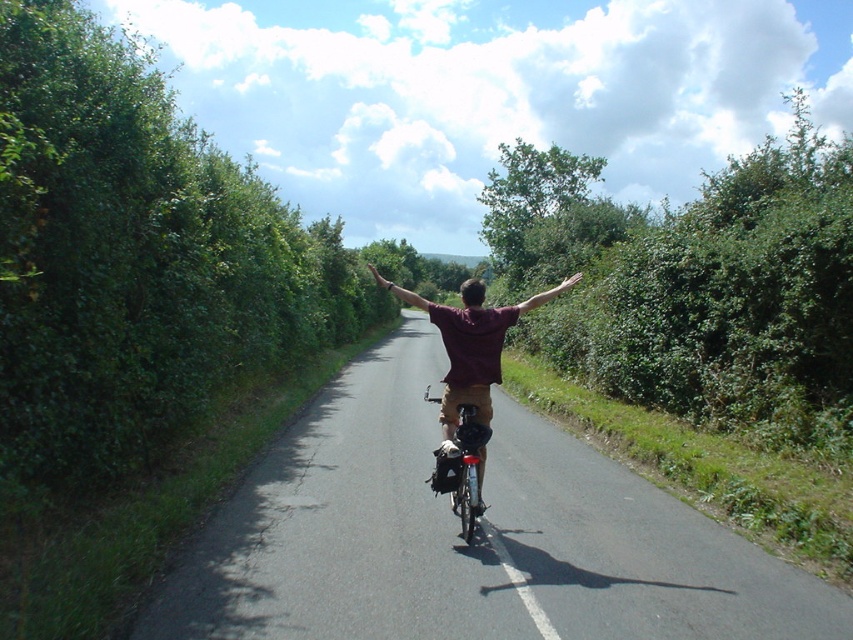
You are a cyclist on the narrow road and you want to check if your hand is above your arm while riding. Based on the scene, is the smooth skin hand at upper center positioned above the brown fabric arm at center?

Yes, the smooth skin hand at upper center is positioned above the brown fabric arm at center as described in the scene.

You are a cyclist riding along the road and want to reach the brown fabric arm at center located at point (543,296). What direction should you head towards?

The brown fabric arm at center is located at point (543,296), so you should head towards that coordinate to reach it.

You are a cyclist approaching a narrow road with dense greenery on both sides. You notice a smooth skin hand at upper center and a brown leather hand at center. Which hand is closer to you as you ride towards them?

The brown leather hand at center is closer to you because it is at center, while the smooth skin hand at upper center is further away.